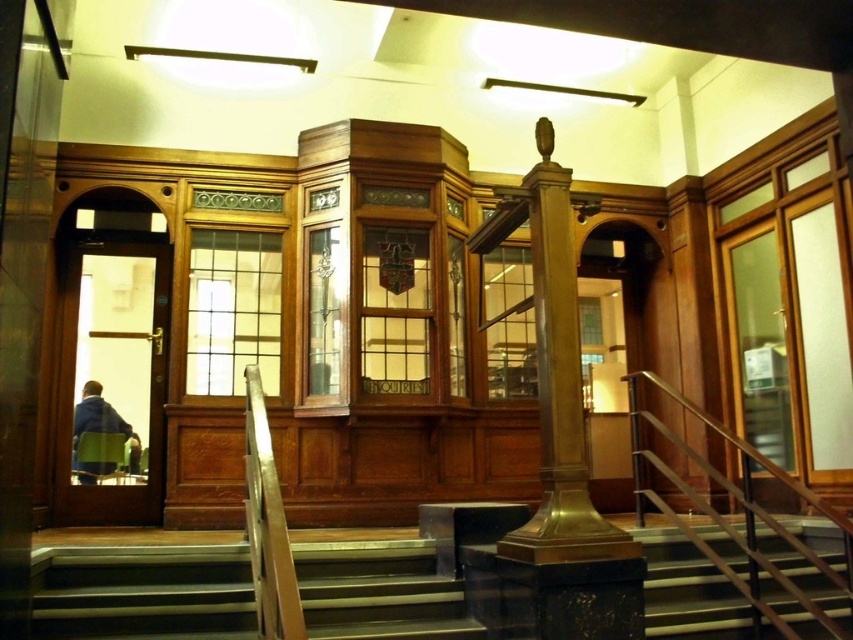
Is point (534, 528) in front of point (728, 566)?

Yes, point (534, 528) is closer to viewer.

Does polished brass column at center have a larger size compared to polished metal railing at right?

No.

The image size is (853, 640). What do you see at coordinates (560, 436) in the screenshot? I see `polished brass column at center` at bounding box center [560, 436].

Locate an element on the screen. The height and width of the screenshot is (640, 853). polished brass column at center is located at coordinates (560, 436).

Which is more to the right, polished marble steps at center or blue fabric jacket at left?

polished marble steps at center

Between point (422, 589) and point (80, 433), which one is positioned behind?

The point (80, 433) is behind.

What are the coordinates of `polished marble steps at center` in the screenshot? It's located at (142, 592).

Does polished brass column at center have a lesser width compared to blue fabric jacket at left?

In fact, polished brass column at center might be wider than blue fabric jacket at left.

Locate an element on the screen. polished brass column at center is located at coordinates (560, 436).